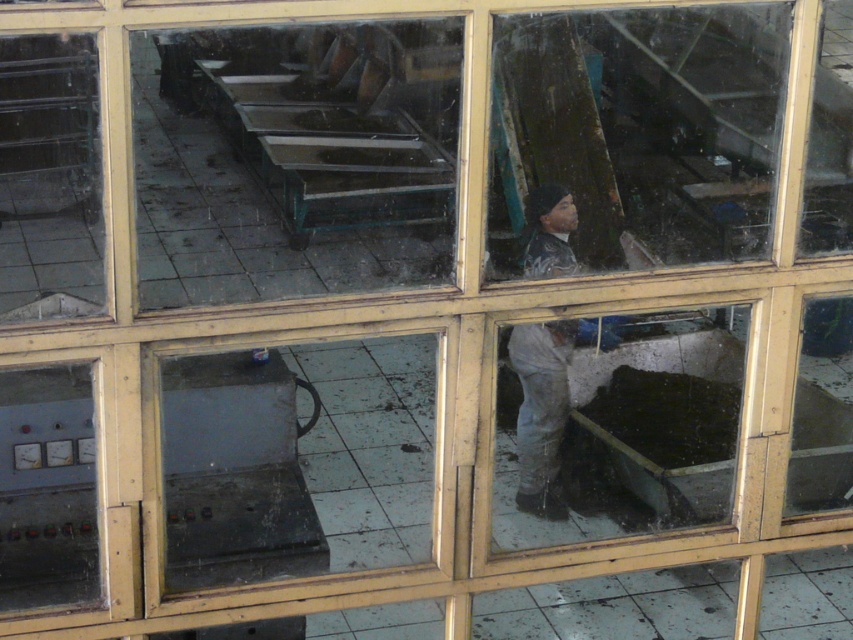
Is transparent glass table at upper left to the right of gray fabric worker at center from the viewer's perspective?

No, transparent glass table at upper left is not to the right of gray fabric worker at center.

Locate an element on the screen. This screenshot has height=640, width=853. transparent glass table at upper left is located at coordinates (294, 160).

Is point (187, 108) more distant than point (538, 461)?

Yes, it is.

Where is `transparent glass table at upper left`? This screenshot has height=640, width=853. transparent glass table at upper left is located at coordinates (294, 160).